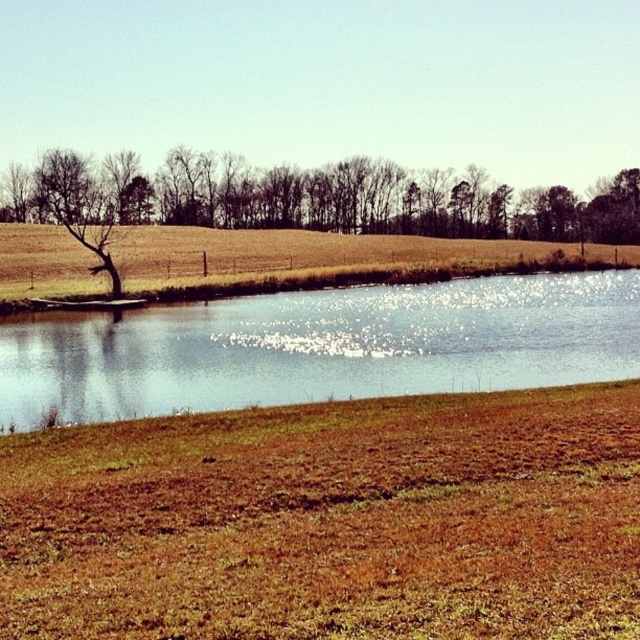
You are a gardener planning to plant flowers in the brown soil at lower center and the brown grassy field at center. Which area has a smaller width for planting?

The brown soil at lower center has a lesser width compared to the brown grassy field at center, so it has a smaller width for planting.

You are a gardener planning to plant a flower bed between the brown soil at lower center and the blue glassy lake at center. Which object should you start preparing first, the one closer to you or the one further away?

The brown soil at lower center is below the blue glassy lake at center, so the brown soil at lower center is closer to you. Therefore, you should start preparing the brown soil at lower center first.